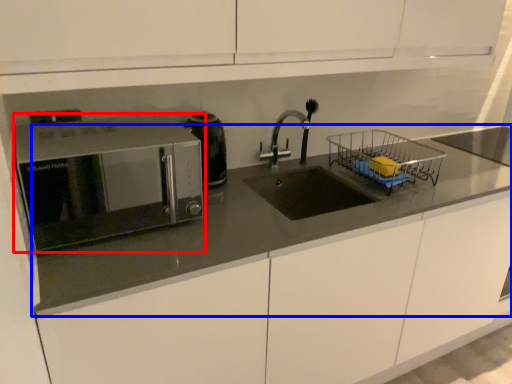
Question: Among these objects, which one is nearest to the camera, microwave oven (highlighted by a red box) or countertop (highlighted by a blue box)?

Choices:
 (A) microwave oven
 (B) countertop

Answer: (B)